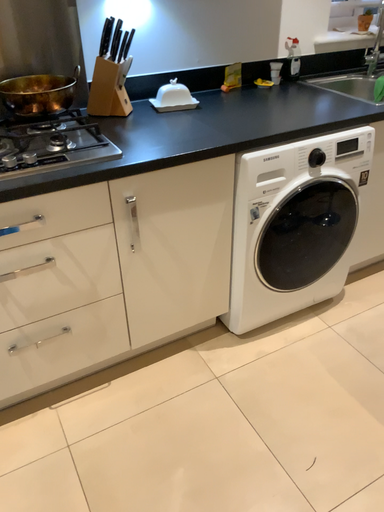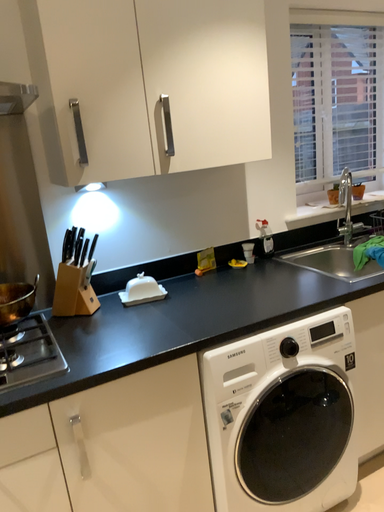
Question: Which way did the camera rotate in the video?

Choices:
 (A) rotated upward
 (B) rotated downward

Answer: (A)